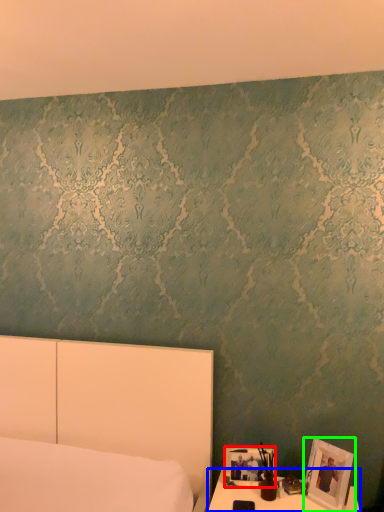
Question: Considering the real-world distances, which object is farthest from picture frame (highlighted by a red box)? table (highlighted by a blue box) or picture frame (highlighted by a green box)?

Choices:
 (A) table
 (B) picture frame

Answer: (B)